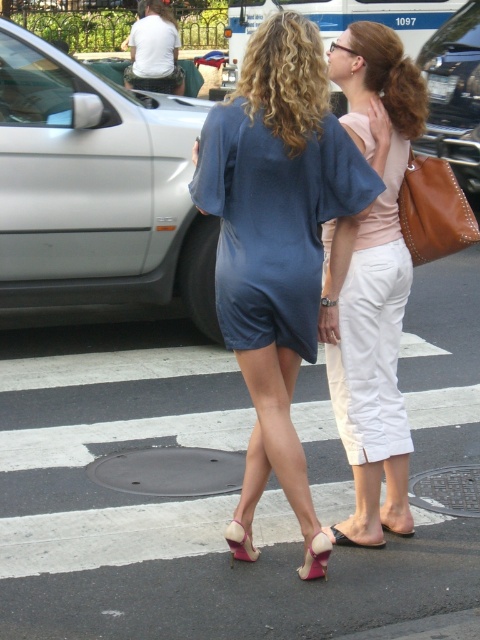
Question: Considering the real-world distances, which object is closest to the metallic silver van at center?

Choices:
 (A) black leather sandal at lower center
 (B) blue satin dress at center
 (C) metallic silver car at center

Answer: (C)

Question: Is blue satin dress at center to the left of pink suede sandal at center from the viewer's perspective?

Choices:
 (A) yes
 (B) no

Answer: (B)

Question: Does silver metallic car at left have a greater width compared to metallic silver van at center?

Choices:
 (A) yes
 (B) no

Answer: (B)

Question: Considering the relative positions of matte blue dress at center and light beige cotton pants at center in the image provided, where is matte blue dress at center located with respect to light beige cotton pants at center?

Choices:
 (A) above
 (B) below

Answer: (B)

Question: Which object is closer to the camera taking this photo?

Choices:
 (A) metallic silver van at center
 (B) blue satin dress at center

Answer: (B)

Question: Which object is closer to the camera taking this photo?

Choices:
 (A) silver metallic car at left
 (B) pink suede sandal at center

Answer: (B)